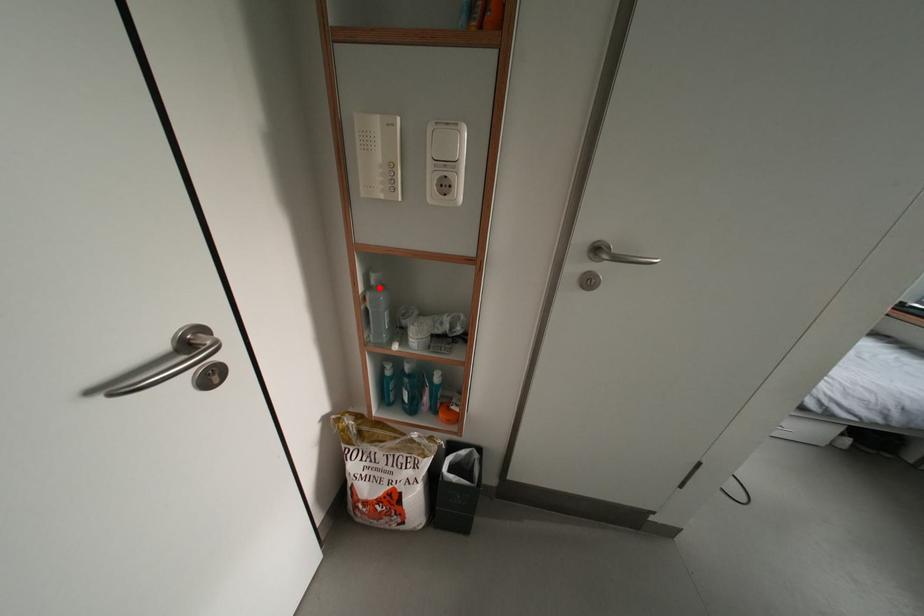
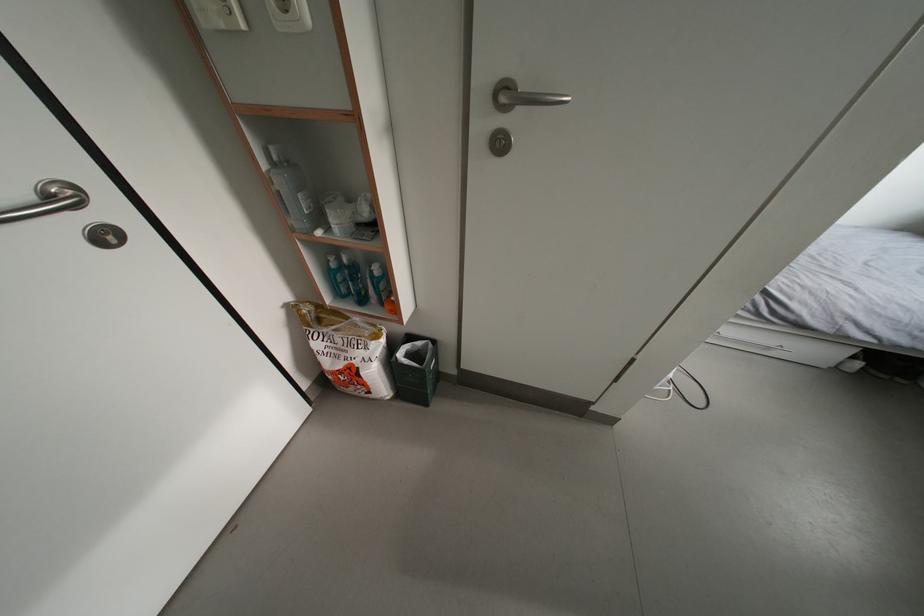
The point at the highlighted location is marked in the first image. Where is the corresponding point in the second image?

(283, 163)